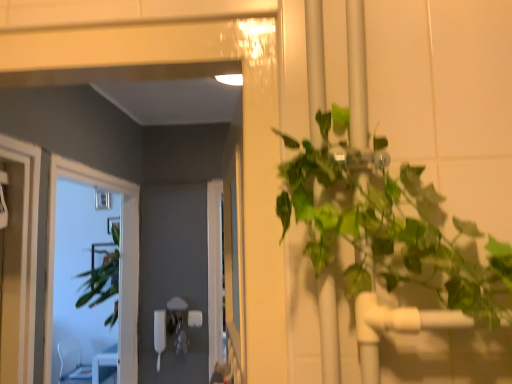
Question: From a real-world perspective, is clear glass window at left on top of clear plastic chair at lower left?

Choices:
 (A) yes
 (B) no

Answer: (A)

Question: Considering the relative sizes of clear glass window at left and clear plastic chair at lower left in the image provided, is clear glass window at left shorter than clear plastic chair at lower left?

Choices:
 (A) no
 (B) yes

Answer: (A)

Question: Can you confirm if clear glass window at left is bigger than clear plastic chair at lower left?

Choices:
 (A) yes
 (B) no

Answer: (A)

Question: Is clear glass window at left outside of clear plastic chair at lower left?

Choices:
 (A) no
 (B) yes

Answer: (B)

Question: Considering the relative sizes of clear glass window at left and clear plastic chair at lower left in the image provided, is clear glass window at left thinner than clear plastic chair at lower left?

Choices:
 (A) yes
 (B) no

Answer: (A)

Question: Does clear glass window at left lie behind clear plastic chair at lower left?

Choices:
 (A) no
 (B) yes

Answer: (A)

Question: Are clear plastic chair at lower left and clear glass window at left making contact?

Choices:
 (A) no
 (B) yes

Answer: (A)

Question: Considering the relative sizes of clear plastic chair at lower left and clear glass window at left in the image provided, is clear plastic chair at lower left wider than clear glass window at left?

Choices:
 (A) yes
 (B) no

Answer: (A)

Question: Does clear plastic chair at lower left appear on the right side of clear glass window at left?

Choices:
 (A) no
 (B) yes

Answer: (A)

Question: Is clear plastic chair at lower left taller than clear glass window at left?

Choices:
 (A) no
 (B) yes

Answer: (A)

Question: Considering the relative sizes of clear plastic chair at lower left and clear glass window at left in the image provided, is clear plastic chair at lower left bigger than clear glass window at left?

Choices:
 (A) yes
 (B) no

Answer: (B)

Question: From the image's perspective, is clear plastic chair at lower left located above clear glass window at left?

Choices:
 (A) yes
 (B) no

Answer: (B)

Question: Would you say clear glass window at left is to the left or to the right of clear plastic chair at lower left in the picture?

Choices:
 (A) right
 (B) left

Answer: (A)